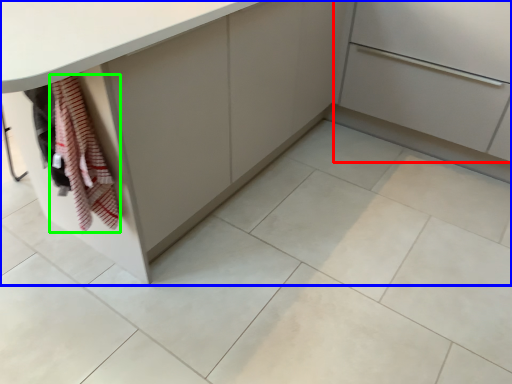
Question: Which is nearer to the cabinetry (highlighted by a red box)? cabinetry (highlighted by a blue box) or blanket (highlighted by a green box).

Choices:
 (A) cabinetry
 (B) blanket

Answer: (A)